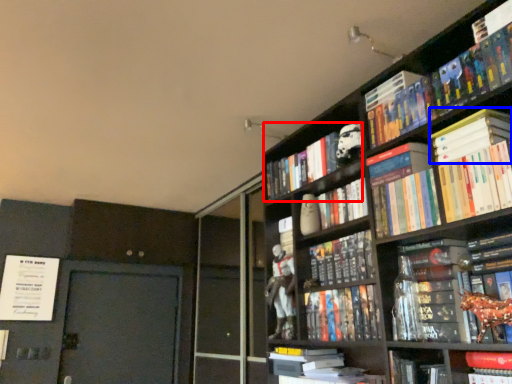
Question: Which point is closer to the camera, book (highlighted by a red box) or book (highlighted by a blue box)?

Choices:
 (A) book
 (B) book

Answer: (B)